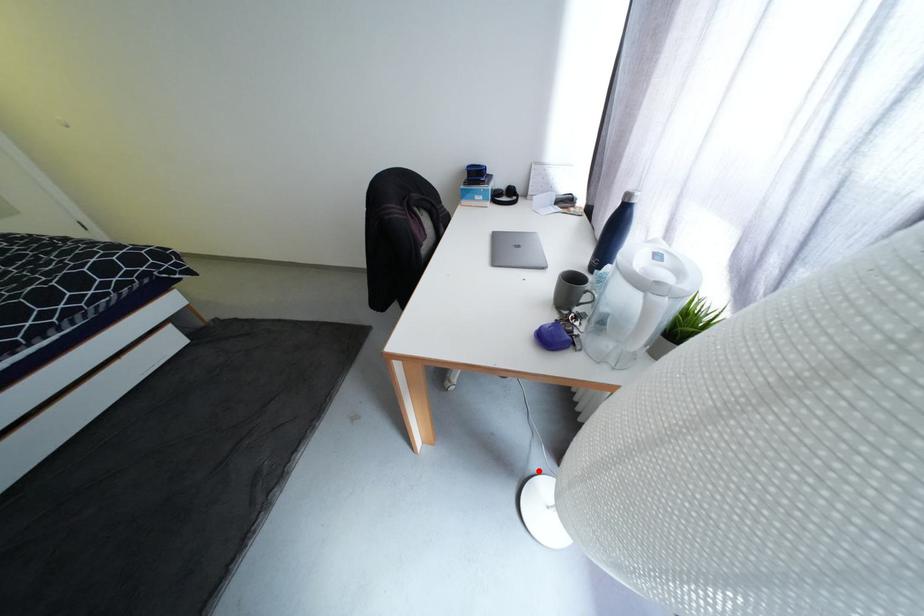
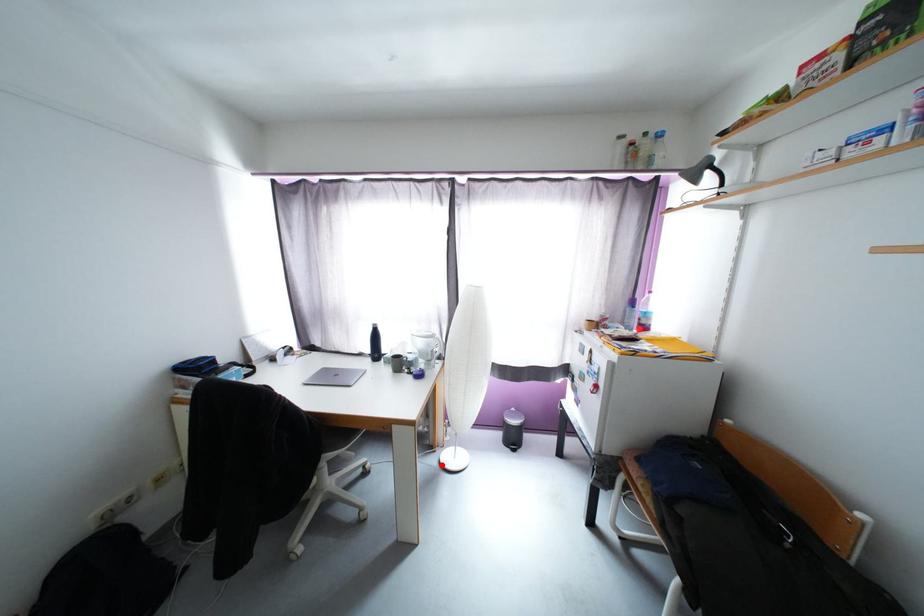
I am providing you with two images of the same scene from different viewpoints. A red point is marked on the first image and another point is marked on the second image. Does the point marked in image1 correspond to the same location as the one in image2?

Yes